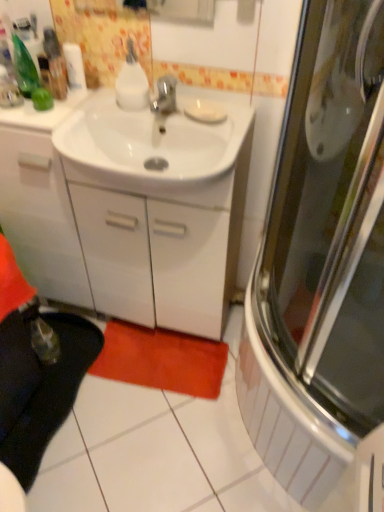
Locate an element on the screen. The height and width of the screenshot is (512, 384). vacant space in front of translucent plastic bottles at upper left is located at coordinates (35, 115).